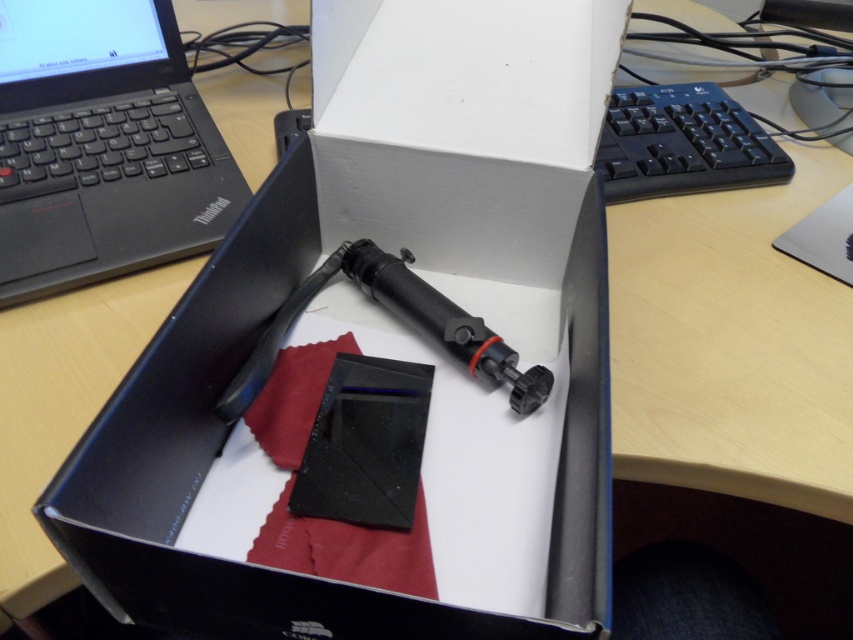
You are organizing a desk and need to place the black plastic keyboard at upper right and the black rubberized pen at center into a drawer. The drawer has a width of 15 cm. Knowing that the keyboard is wider than the pen, can both items fit side by side in the drawer?

The black plastic keyboard at upper right is wider than the black rubberized pen at center. However, without specific measurements, it is impossible to determine if both items can fit side by side in a 15 cm wide drawer. Additional information about their individual widths is required.

You are organizing items on a desk and need to place a new item between the black matte thinkpad at upper left and the black rubberized pen at center. Based on their positions, which item is closer to you, and where should you position the new item?

The black matte thinkpad at upper left is closer to you than the black rubberized pen at center. To place the new item between them, position it closer to the black rubberized pen at center but still behind the black matte thinkpad at upper left.